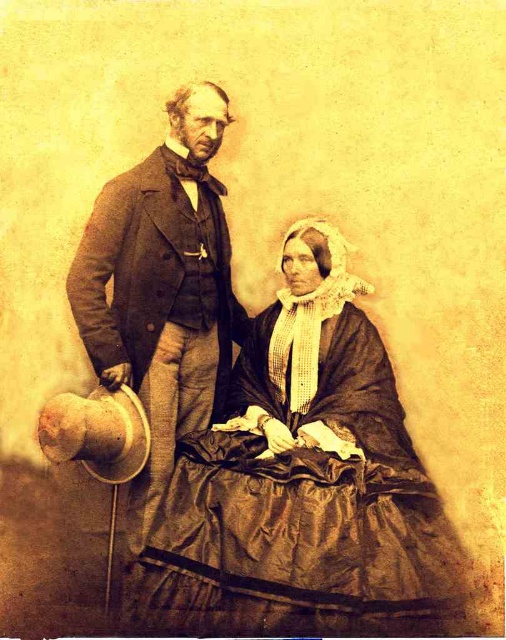
In the sepia photograph, there is a matte black dress at center and a matte brown suit at upper left. Which object takes up more space in the image?

The matte black dress at center is larger in size than the matte brown suit at upper left, so it takes up more space in the image.

You are a photographer in the 19th century. You have a limited amount of space in your studio. You need to arrange the matte black dress at center and the matte brown suit at upper left in a way that they don t overlap. Which object should you place further back to ensure they don t take up too much space in the front?

The matte black dress at center has a wider skirt, so placing it further back would help reduce its prominence in the front area, allowing both items to fit without overlapping.

Looking at this image, you are an art historian examining this 19th century photograph. You notice two figures in the image. The first is a woman wearing a matte black dress at center, and the second is a man in a matte brown suit at upper left. Based on their positions, which figure is closer to the right edge of the photograph?

The matte black dress at center is positioned on the right side of the matte brown suit at upper left, so the woman in the matte black dress at center is closer to the right edge of the photograph.